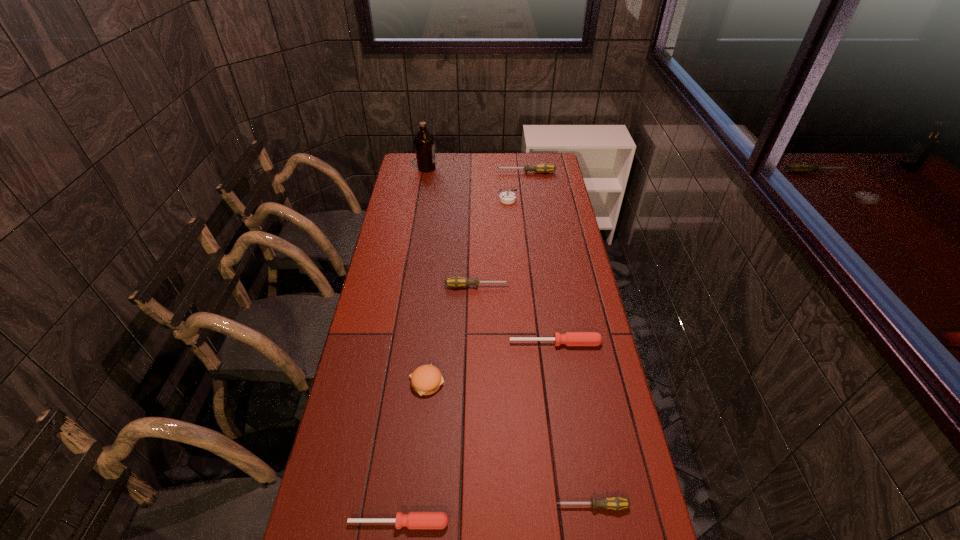
This screenshot has height=540, width=960. What are the coordinates of `vacant area situated 0.230m at the tip of the fifth nearest object` in the screenshot? It's located at point(571,286).

You are a GUI agent. You are given a task and a screenshot of the screen. Output one action in this format:
    pyautogui.click(x=<x>, y=<y>)
    Task: Click on the vacant area located 0.340m on the back of the right red screwdriver
    The width and height of the screenshot is (960, 540).
    Given the screenshot: What is the action you would take?
    pyautogui.click(x=544, y=268)

Where is `free space located 0.090m on the right of the nearer red screwdriver`? The width and height of the screenshot is (960, 540). free space located 0.090m on the right of the nearer red screwdriver is located at coordinates pyautogui.click(x=487, y=523).

Identify the location of free space located 0.320m at the tip of the seventh farthest object. The width and height of the screenshot is (960, 540). (425, 505).

Locate an element on the screen. This screenshot has width=960, height=540. vacant space located at the tip of the seventh farthest object is located at coordinates (414, 505).

Find the location of `free space located at the tip of the seventh farthest object`. free space located at the tip of the seventh farthest object is located at coordinates (425, 505).

The image size is (960, 540). I want to click on olive oil that is at the far edge, so click(x=424, y=142).

What are the coordinates of `screwdriver at the far edge` in the screenshot? It's located at (543, 167).

Locate an element on the screen. The height and width of the screenshot is (540, 960). olive oil present at the left edge is located at coordinates (424, 142).

The width and height of the screenshot is (960, 540). I want to click on screwdriver that is at the left edge, so (x=414, y=520).